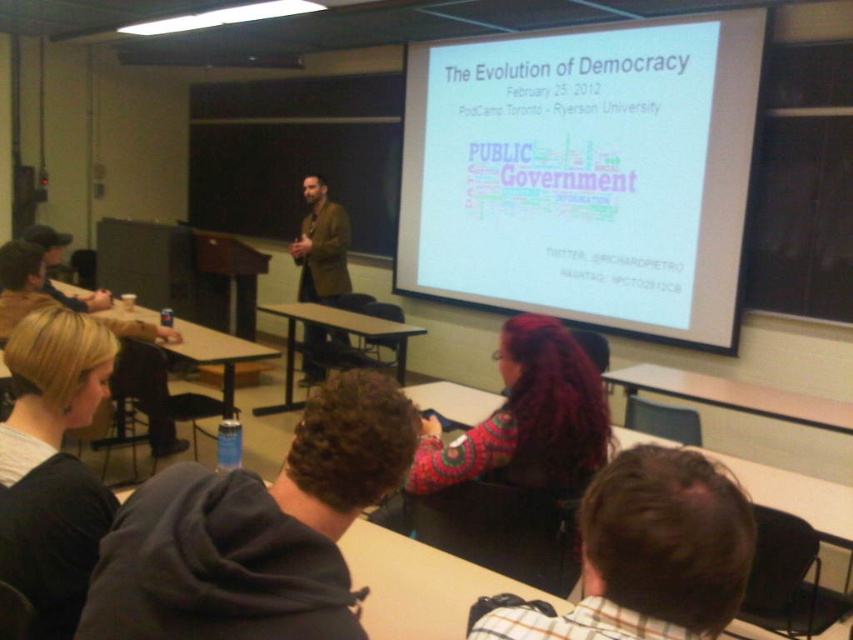
You are a student in the classroom and want to see both the white matte projection screen at upper center and the brown leather jacket at center. Which object is higher in the room?

The white matte projection screen at upper center is located above the brown leather jacket at center, so it is higher in the room.

You are a student sitting at your desk in the classroom. You notice two points on the slide during the presentation. The first point is labeled as point (700, 339) and the second is point (334, 333). If you were to walk from your desk to these points on the slide, which point would you reach first?

Point (700, 339) is in front of point (334, 333), so you would reach point (700, 339) first.